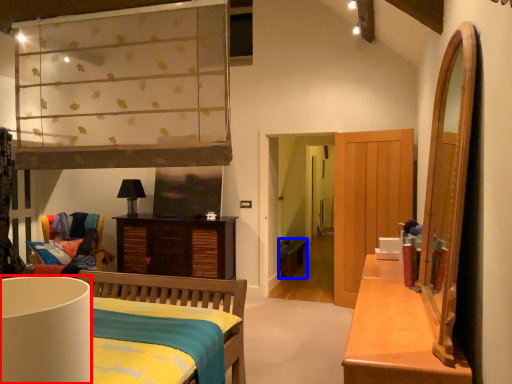
Question: Among these objects, which one is farthest to the camera, lamp (highlighted by a red box) or studio couch (highlighted by a blue box)?

Choices:
 (A) lamp
 (B) studio couch

Answer: (B)